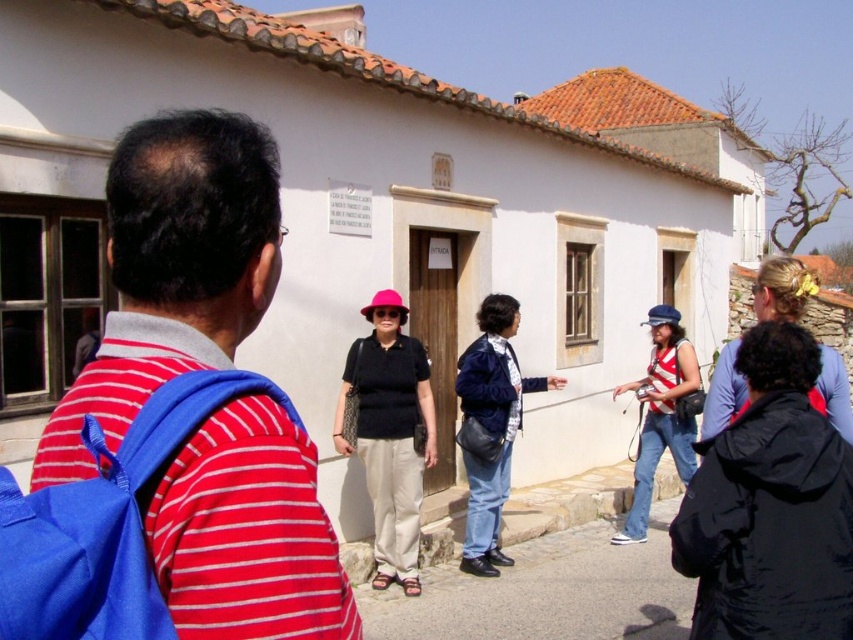
Is red striped shirt at left below striped fabric tank top at center?

Incorrect, red striped shirt at left is not positioned below striped fabric tank top at center.

Which is more to the right, red striped shirt at left or striped fabric tank top at center?

striped fabric tank top at center

Where is `red striped shirt at left`? The width and height of the screenshot is (853, 640). red striped shirt at left is located at coordinates (173, 269).

Can you confirm if red striped shirt at left is positioned to the right of denim jacket at center?

No, red striped shirt at left is not to the right of denim jacket at center.

Is point (245, 614) farther from viewer compared to point (480, 515)?

No, (245, 614) is closer to viewer.

Find the location of `red striped shirt at left`. red striped shirt at left is located at coordinates (173, 269).

Is red striped shirt at left wider than pink matte hat at center?

No, red striped shirt at left is not wider than pink matte hat at center.

Is point (277, 180) closer to camera compared to point (389, 564)?

Yes, point (277, 180) is closer to viewer.

Identify the location of red striped shirt at left. (173, 269).

This screenshot has height=640, width=853. I want to click on red striped shirt at left, so click(x=173, y=269).